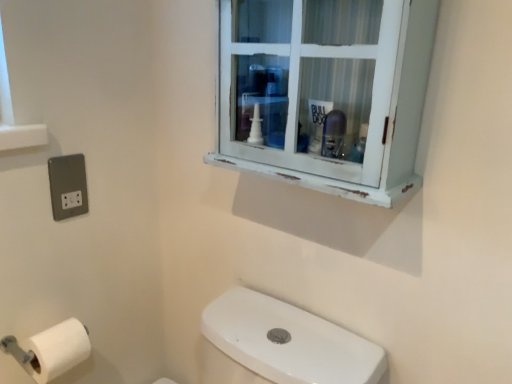
Question: Does white matte toilet paper at lower left contain white distressed cabinet at upper center?

Choices:
 (A) no
 (B) yes

Answer: (A)

Question: From the image's perspective, would you say white matte toilet paper at lower left is shown under white distressed cabinet at upper center?

Choices:
 (A) no
 (B) yes

Answer: (B)

Question: Can you confirm if white matte toilet paper at lower left is thinner than white distressed cabinet at upper center?

Choices:
 (A) no
 (B) yes

Answer: (B)

Question: Can you confirm if white matte toilet paper at lower left is bigger than white distressed cabinet at upper center?

Choices:
 (A) no
 (B) yes

Answer: (A)

Question: Is white matte toilet paper at lower left completely or partially outside of white distressed cabinet at upper center?

Choices:
 (A) no
 (B) yes

Answer: (B)

Question: Considering the relative sizes of white matte toilet paper at lower left and white distressed cabinet at upper center in the image provided, is white matte toilet paper at lower left smaller than white distressed cabinet at upper center?

Choices:
 (A) yes
 (B) no

Answer: (A)

Question: Can you confirm if white distressed cabinet at upper center is smaller than white matte toilet paper at lower left?

Choices:
 (A) no
 (B) yes

Answer: (A)

Question: From a real-world perspective, is white distressed cabinet at upper center on top of white matte toilet paper at lower left?

Choices:
 (A) no
 (B) yes

Answer: (B)

Question: From the image's perspective, would you say white distressed cabinet at upper center is positioned over white matte toilet paper at lower left?

Choices:
 (A) yes
 (B) no

Answer: (A)

Question: Is white distressed cabinet at upper center oriented towards white matte toilet paper at lower left?

Choices:
 (A) no
 (B) yes

Answer: (A)

Question: Does white distressed cabinet at upper center have a lesser width compared to white matte toilet paper at lower left?

Choices:
 (A) yes
 (B) no

Answer: (B)

Question: From a real-world perspective, does white distressed cabinet at upper center sit lower than white matte toilet paper at lower left?

Choices:
 (A) no
 (B) yes

Answer: (A)

Question: Does white matte toilet paper at lower left have a larger size compared to satin silver socket at lower left?

Choices:
 (A) yes
 (B) no

Answer: (A)